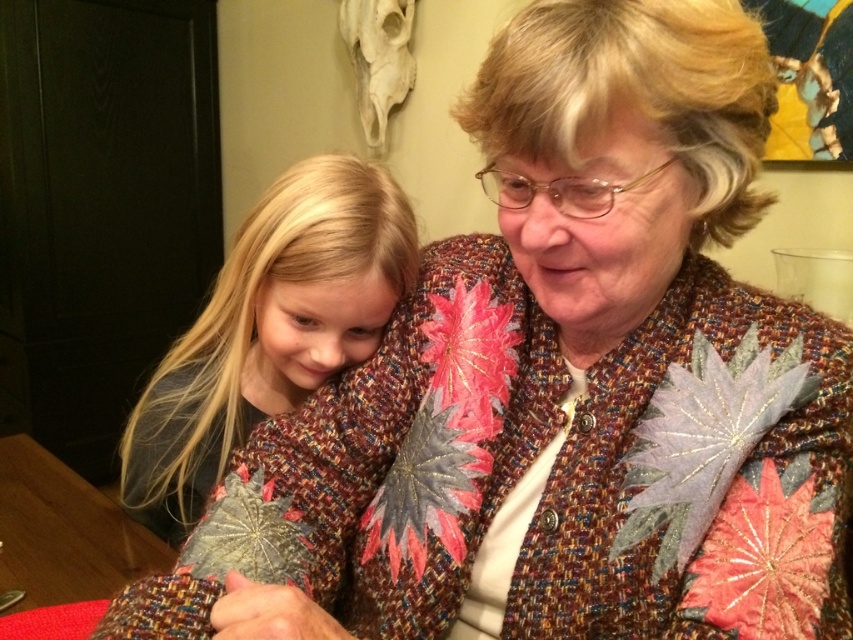
Question: Among these points, which one is nearest to the camera?

Choices:
 (A) (97, 522)
 (B) (154, 412)

Answer: (B)

Question: Which object appears farthest from the camera in this image?

Choices:
 (A) wooden table at lower left
 (B) blonde hair at left

Answer: (A)

Question: Is blonde hair at left closer to camera compared to wooden table at lower left?

Choices:
 (A) no
 (B) yes

Answer: (B)

Question: Does blonde hair at left appear on the right side of wooden table at lower left?

Choices:
 (A) no
 (B) yes

Answer: (B)

Question: Is blonde hair at left above wooden table at lower left?

Choices:
 (A) yes
 (B) no

Answer: (A)

Question: Among these objects, which one is farthest from the camera?

Choices:
 (A) blonde hair at left
 (B) wooden table at lower left

Answer: (B)